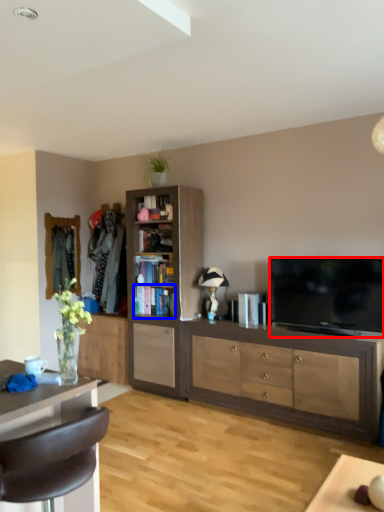
Question: Among these objects, which one is farthest to the camera, television (highlighted by a red box) or shelf (highlighted by a blue box)?

Choices:
 (A) television
 (B) shelf

Answer: (B)